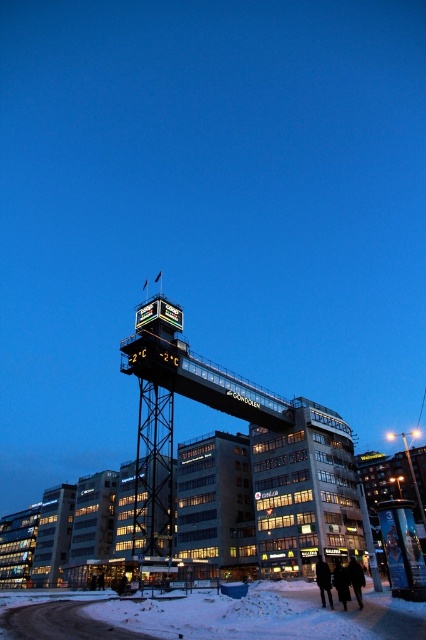
Is white powdery snow at lower center positioned before black fabric coat at lower center?

Yes, white powdery snow at lower center is closer to the viewer.

Does white powdery snow at lower center appear on the left side of black fabric coat at lower center?

Indeed, white powdery snow at lower center is positioned on the left side of black fabric coat at lower center.

Describe the element at coordinates (230, 618) in the screenshot. I see `white powdery snow at lower center` at that location.

Locate an element on the screen. The image size is (426, 640). white powdery snow at lower center is located at coordinates (230, 618).

Between glassy transparent building at center and black fabric coat at lower center, which one is positioned higher?

Positioned higher is glassy transparent building at center.

Based on the photo, is glassy transparent building at center wider than black fabric coat at lower center?

Yes, glassy transparent building at center is wider than black fabric coat at lower center.

Is point (310, 508) closer to camera compared to point (353, 580)?

No, it is not.

In order to click on glassy transparent building at center in this screenshot , I will do [305, 492].

Is glassy transparent building at center behind white powdery snow at lower center?

Yes.

Which is in front, point (302, 525) or point (423, 611)?

Point (423, 611) is in front.

Identify the location of glassy transparent building at center. This screenshot has width=426, height=640. (305, 492).